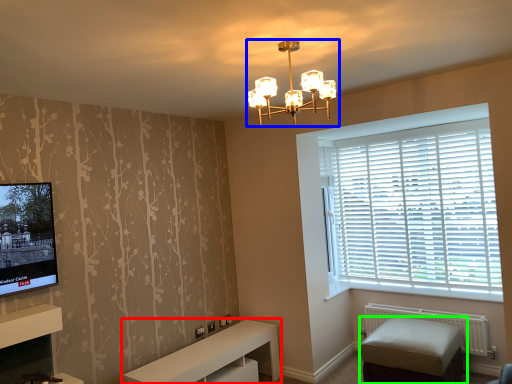
Question: Based on their relative distances, which object is farther from furniture (highlighted by a red box)? Choose from lamp (highlighted by a blue box) and studio couch (highlighted by a green box).

Choices:
 (A) lamp
 (B) studio couch

Answer: (A)